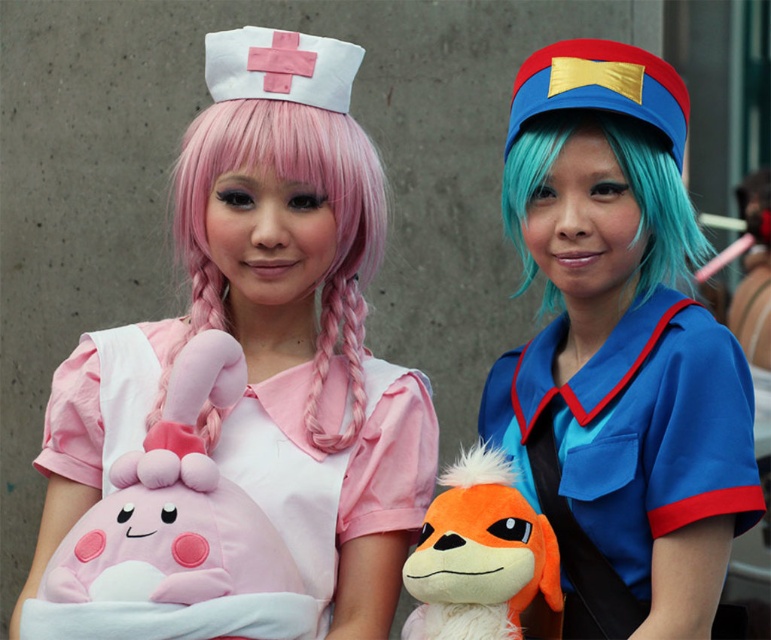
Question: Considering the relative positions of blue fabric uniform at center and soft plush kirby at center in the image provided, where is blue fabric uniform at center located with respect to soft plush kirby at center?

Choices:
 (A) left
 (B) right

Answer: (B)

Question: Can you confirm if blue fabric uniform at center is positioned to the right of soft plush kirby at center?

Choices:
 (A) yes
 (B) no

Answer: (A)

Question: Does orange plush toy at center have a smaller size compared to teal matte wig at right?

Choices:
 (A) yes
 (B) no

Answer: (A)

Question: Which is farther from the matte pink plushie at center?

Choices:
 (A) teal matte wig at right
 (B) soft plush kirby at center
 (C) blue fabric uniform at center

Answer: (A)

Question: Which object is positioned farthest from the matte pink plushie at center?

Choices:
 (A) blue fabric uniform at center
 (B) orange plush toy at center
 (C) soft plush kirby at center
 (D) pink silky hair at center

Answer: (A)

Question: Which is farther from the matte pink plushie at center?

Choices:
 (A) blue fabric uniform at center
 (B) teal matte wig at right
 (C) soft plush kirby at center

Answer: (B)